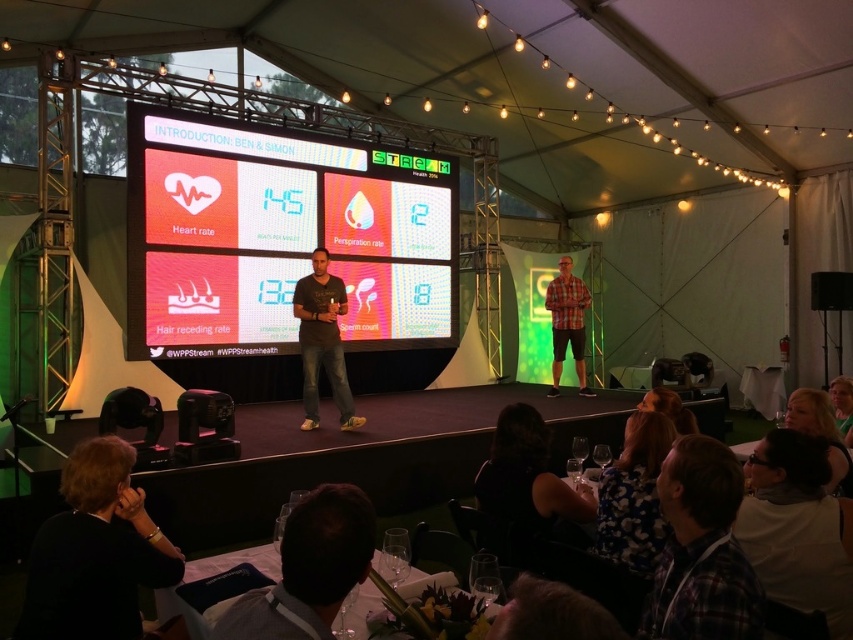
Does dark brown hair at lower center appear over black fabric at lower center?

Yes, dark brown hair at lower center is above black fabric at lower center.

Is dark brown hair at lower center bigger than black fabric at lower center?

Incorrect, dark brown hair at lower center is not larger than black fabric at lower center.

Is point (292, 628) closer to camera compared to point (502, 465)?

Yes, point (292, 628) is in front of point (502, 465).

Where is `dark brown hair at lower center`? The height and width of the screenshot is (640, 853). dark brown hair at lower center is located at coordinates (308, 570).

Can you confirm if plaid fabric shirt at center is shorter than blonde hair at lower center?

No.

Between plaid fabric shirt at center and blonde hair at lower center, which one appears on the right side from the viewer's perspective?

Positioned to the right is plaid fabric shirt at center.

At what (x,y) coordinates should I click in order to perform the action: click on plaid fabric shirt at center. Please return your answer as a coordinate pair (x, y). The width and height of the screenshot is (853, 640). Looking at the image, I should click on (567, 323).

Can you confirm if plaid fabric shirt at lower right is bigger than black fabric at lower center?

Actually, plaid fabric shirt at lower right might be smaller than black fabric at lower center.

Looking at this image, which of these two, plaid fabric shirt at lower right or black fabric at lower center, stands taller?

Standing taller between the two is plaid fabric shirt at lower right.

Between point (672, 637) and point (497, 458), which one is positioned in front?

Point (672, 637) is in front.

Image resolution: width=853 pixels, height=640 pixels. I want to click on plaid fabric shirt at lower right, so click(x=701, y=550).